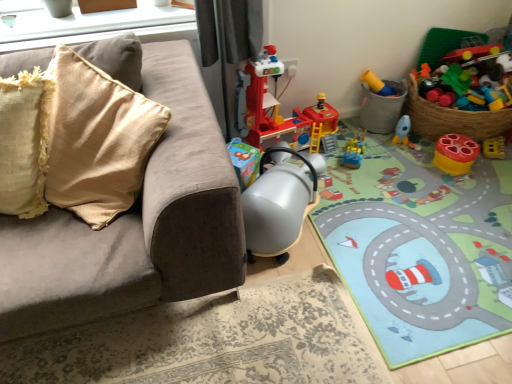
Find the location of a particular element. The height and width of the screenshot is (384, 512). vacant space to the right of translucent plastic train at center, the fifth toy from the right is located at coordinates (390, 155).